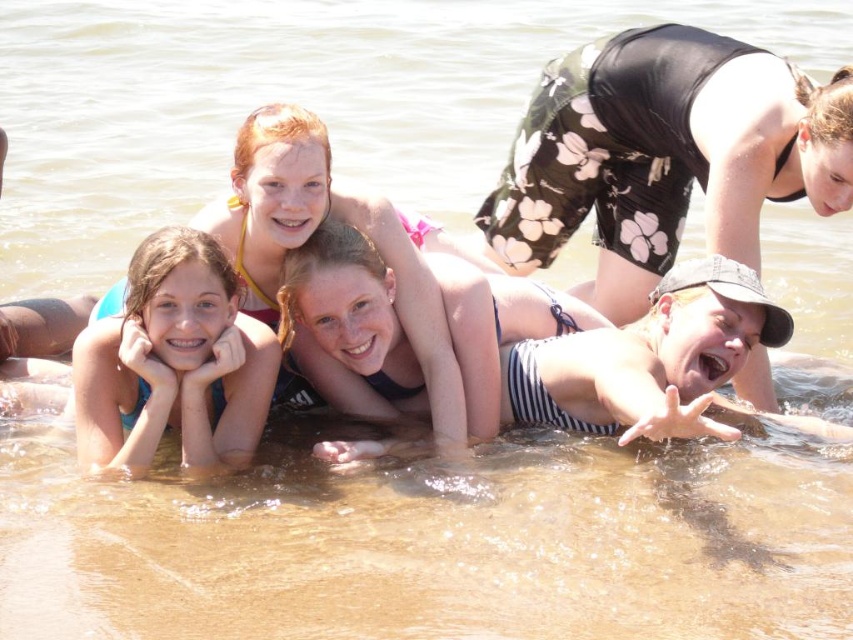
Based on the photo, who is more forward, [549,148] or [239,372]?

Point [239,372]

Can you confirm if striped swimsuit at center is shorter than blue fabric at lower left?

In fact, striped swimsuit at center may be taller than blue fabric at lower left.

What do you see at coordinates (664, 154) in the screenshot? The height and width of the screenshot is (640, 853). I see `striped swimsuit at center` at bounding box center [664, 154].

Locate an element on the screen. This screenshot has height=640, width=853. striped swimsuit at center is located at coordinates (664, 154).